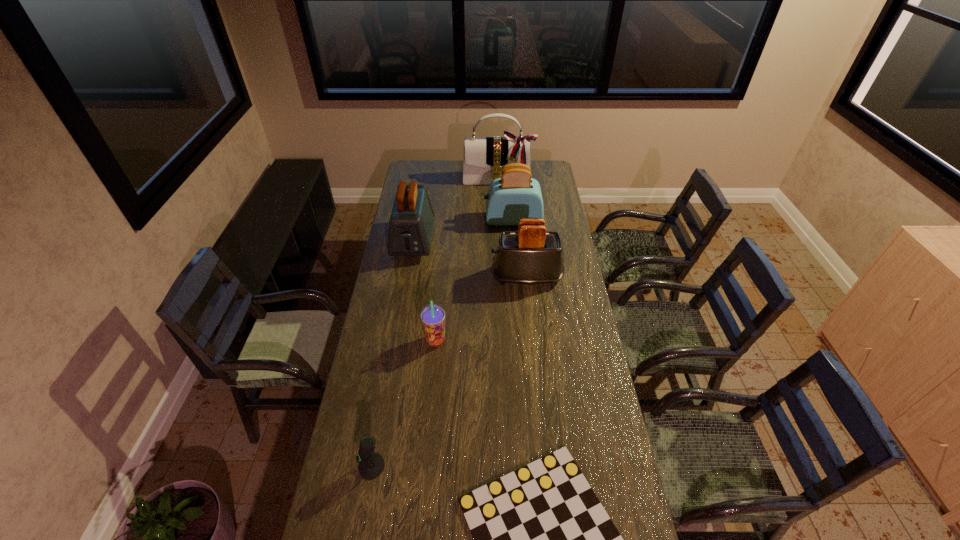
You are a GUI agent. You are given a task and a screenshot of the screen. Output one action in this format:
    pyautogui.click(x=<x>, y=<y>)
    Task: Click on the fourth closest object to the satchel
    The width and height of the screenshot is (960, 540).
    Given the screenshot: What is the action you would take?
    pyautogui.click(x=432, y=316)

Locate an element on the screen. The height and width of the screenshot is (540, 960). toaster that can be found as the closest to the leftmost toaster is located at coordinates (516, 195).

What are the coordinates of `toaster that is the second closest one to the second shortest object` in the screenshot? It's located at (411, 222).